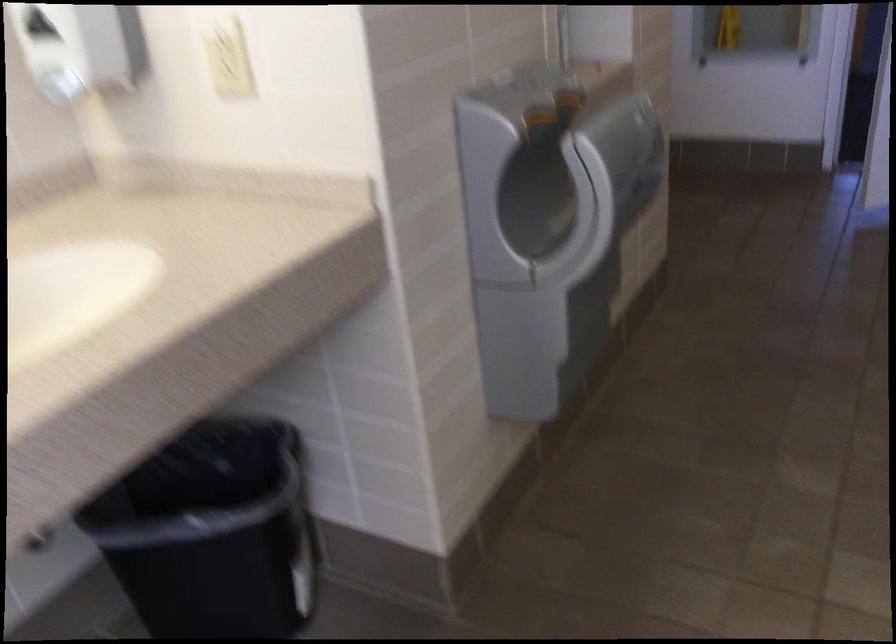
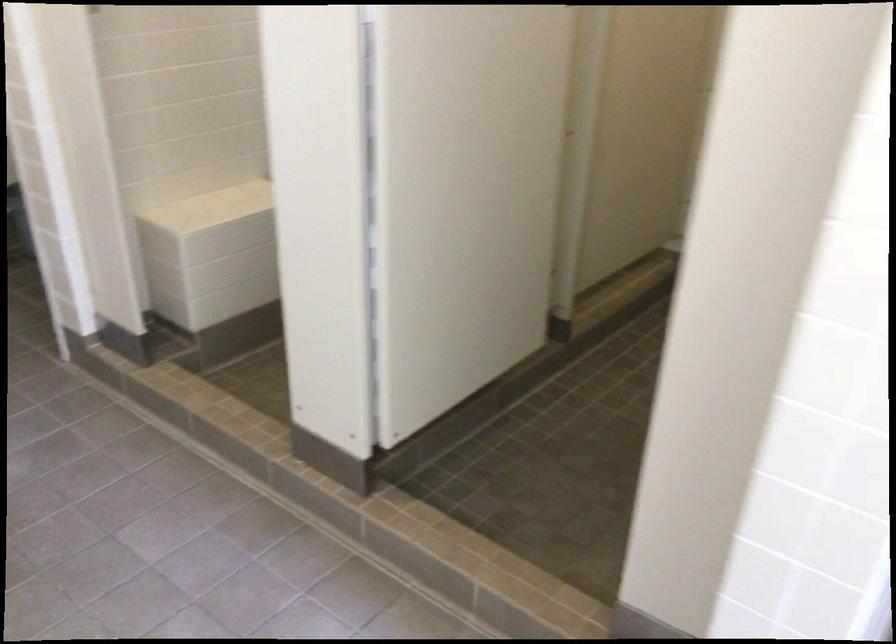
Question: How did the camera likely rotate?

Choices:
 (A) Left
 (B) Right
 (C) Up
 (D) Down

Answer: (B)